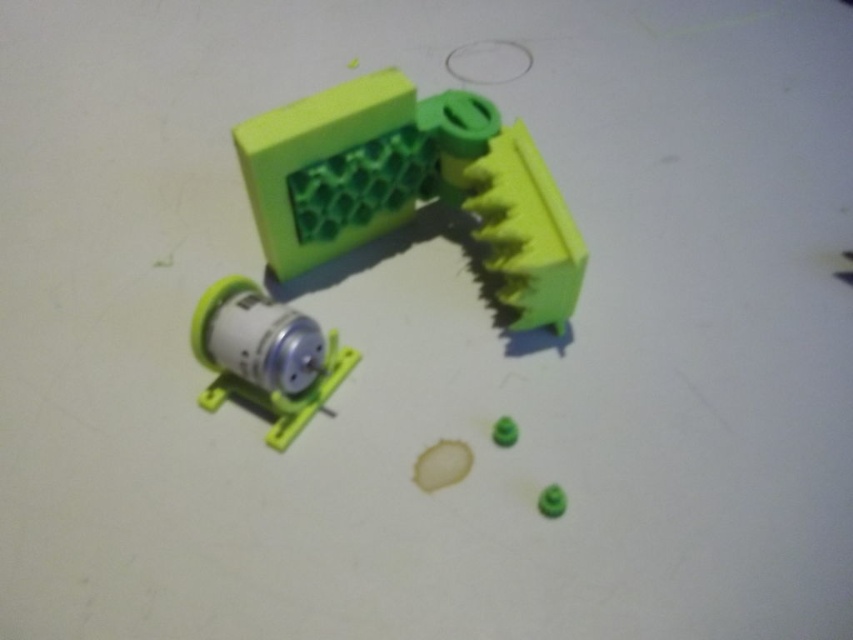
You are a child playing with the green matte ball at lower right and the green matte plastic toy at center. Which object is nearer to your hand?

The green matte ball at lower right is closer to the viewer than the green matte plastic toy at center, so the green matte ball at lower right is nearer to your hand.

You are assembling a small mechanical device and need to place the green matte plastic brush at upper center and the green matte plastic toy at center in their correct positions. According to the image, which object should be placed higher up?

The green matte plastic brush at upper center should be placed higher up because it is located above the green matte plastic toy at center in the image.